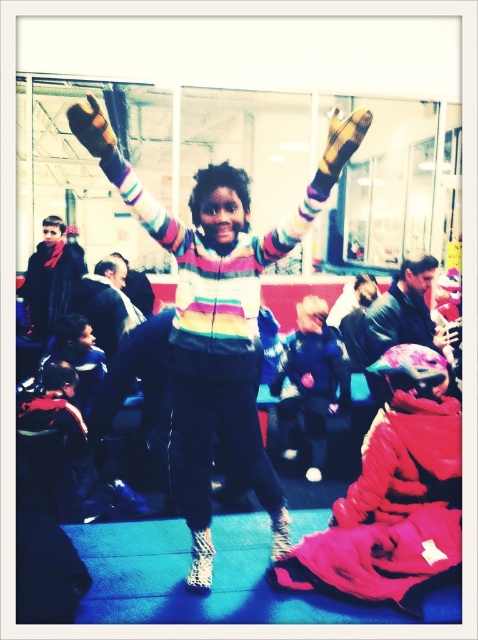
Question: Does striped sweater at center have a greater width compared to shiny blue jacket at center?

Choices:
 (A) yes
 (B) no

Answer: (A)

Question: Which point is farther to the camera?

Choices:
 (A) striped sweater at center
 (B) shiny blue jacket at center

Answer: (B)

Question: Does striped sweater at center appear on the right side of shiny blue jacket at center?

Choices:
 (A) yes
 (B) no

Answer: (B)

Question: Is striped sweater at center smaller than shiny blue jacket at center?

Choices:
 (A) no
 (B) yes

Answer: (A)

Question: Which object appears farthest from the camera in this image?

Choices:
 (A) striped sweater at center
 (B) shiny blue jacket at center

Answer: (B)